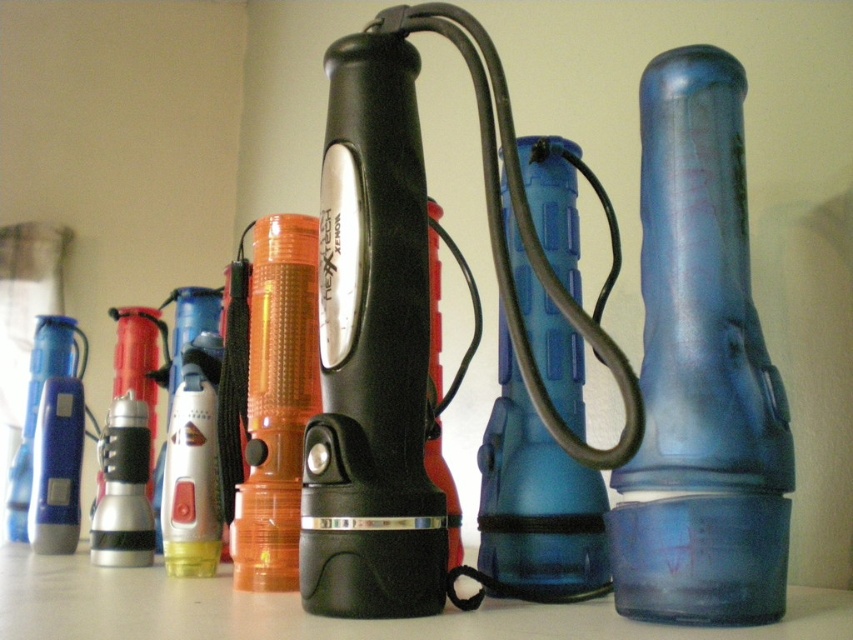
Question: Which object is closer to the camera taking this photo?

Choices:
 (A) transparent blue flashlight at right
 (B) blue translucent bottle at center

Answer: (A)

Question: Does transparent blue flashlight at right have a smaller size compared to blue translucent bottle at center?

Choices:
 (A) no
 (B) yes

Answer: (A)

Question: Is the position of transparent blue flashlight at right more distant than that of blue translucent bottle at center?

Choices:
 (A) yes
 (B) no

Answer: (B)

Question: Does transparent blue flashlight at right have a lesser width compared to blue translucent bottle at center?

Choices:
 (A) yes
 (B) no

Answer: (A)